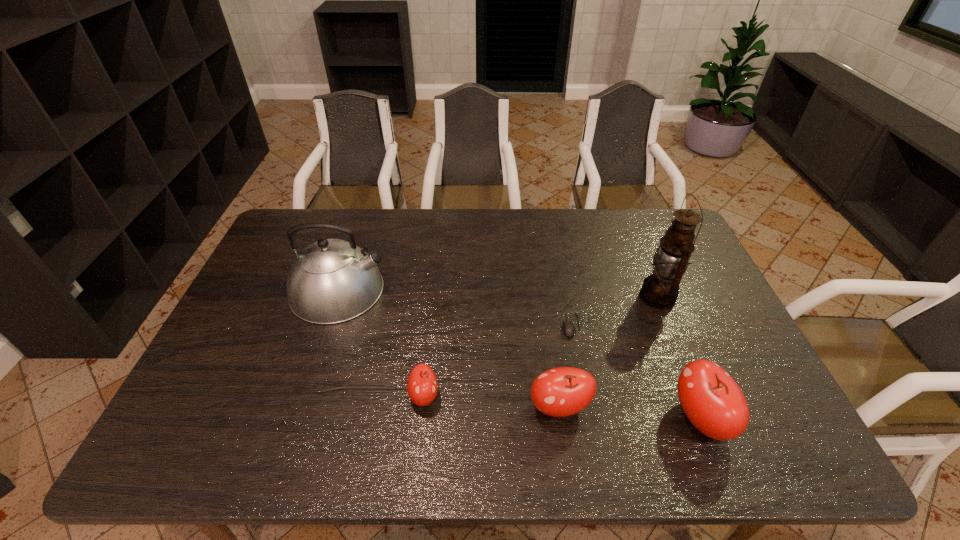
The height and width of the screenshot is (540, 960). In order to click on free point that satisfies the following two spatial constraints: 1. from the spout of the kettle; 2. on the left side of the leftmost apple in this screenshot , I will do `click(303, 396)`.

You are a GUI agent. You are given a task and a screenshot of the screen. Output one action in this format:
    pyautogui.click(x=<x>, y=<y>)
    Task: Click on the vacant position in the image that satisfies the following two spatial constraints: 1. from the spout of the leftmost object; 2. on the back side of the oil lamp
    The image size is (960, 540).
    Given the screenshot: What is the action you would take?
    pyautogui.click(x=337, y=297)

Identify the location of free space that satisfies the following two spatial constraints: 1. on the front side of the fifth tallest object; 2. on the right side of the rightmost apple. The image size is (960, 540). (421, 419).

I want to click on vacant area in the image that satisfies the following two spatial constraints: 1. on the back side of the oil lamp; 2. on the left side of the fifth tallest object, so click(435, 297).